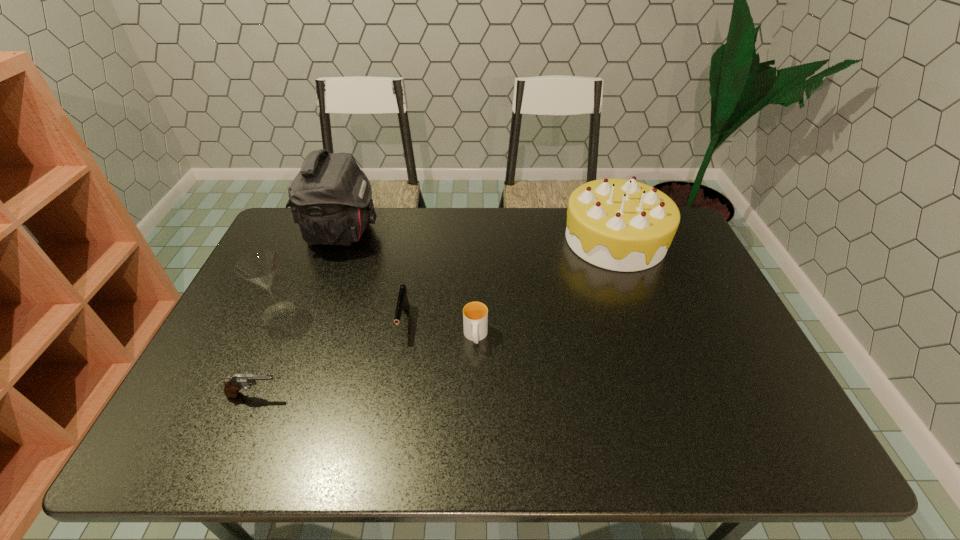
At what (x,y) coordinates should I click in order to perform the action: click on vacant area that lies between the flute glass and the nearer pistol. Please return your answer as a coordinate pair (x, y). This screenshot has height=540, width=960. Looking at the image, I should click on (267, 354).

Where is `free space between the farther pistol and the flute glass`? The height and width of the screenshot is (540, 960). free space between the farther pistol and the flute glass is located at coordinates (342, 318).

The width and height of the screenshot is (960, 540). I want to click on vacant space that's between the right pistol and the flute glass, so click(x=342, y=318).

Identify the location of free space between the second object from right to left and the shoulder bag. (409, 285).

Find the location of a particular element. The height and width of the screenshot is (540, 960). free space between the second object from right to left and the nearer pistol is located at coordinates (365, 366).

At what (x,y) coordinates should I click in order to perform the action: click on free area in between the second object from right to left and the flute glass. Please return your answer as a coordinate pair (x, y). The image size is (960, 540). Looking at the image, I should click on (377, 325).

At what (x,y) coordinates should I click in order to perform the action: click on object that is the third closest to the farther pistol. Please return your answer as a coordinate pair (x, y). The image size is (960, 540). Looking at the image, I should click on (260, 267).

I want to click on the fifth closest object to the fourth object from left to right, so click(622, 225).

Where is `free location that satisfies the following two spatial constraints: 1. with the handle on the side of the cup; 2. at the barrel of the nearest object`? This screenshot has width=960, height=540. free location that satisfies the following two spatial constraints: 1. with the handle on the side of the cup; 2. at the barrel of the nearest object is located at coordinates (475, 395).

This screenshot has width=960, height=540. In order to click on free space that satisfies the following two spatial constraints: 1. with the handle on the side of the cup; 2. at the barrel of the left pistol in this screenshot , I will do `click(475, 395)`.